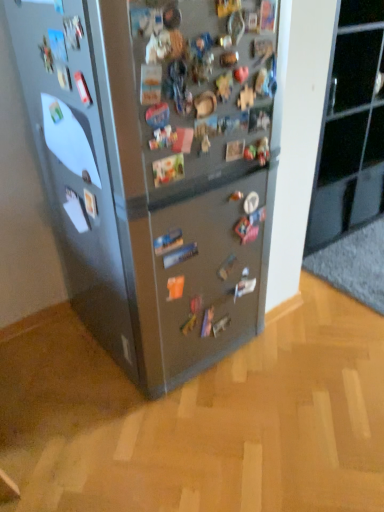
Question: From the image's perspective, would you say glossy black cabinet at upper right is shown under satin silver fridge at center?

Choices:
 (A) no
 (B) yes

Answer: (A)

Question: From the image's perspective, is glossy black cabinet at upper right above satin silver fridge at center?

Choices:
 (A) yes
 (B) no

Answer: (A)

Question: Would you say glossy black cabinet at upper right contains satin silver fridge at center?

Choices:
 (A) no
 (B) yes

Answer: (A)

Question: From a real-world perspective, is glossy black cabinet at upper right physically below satin silver fridge at center?

Choices:
 (A) no
 (B) yes

Answer: (B)

Question: Is glossy black cabinet at upper right far away from satin silver fridge at center?

Choices:
 (A) no
 (B) yes

Answer: (B)

Question: Is satin silver fridge at center at the back of glossy black cabinet at upper right?

Choices:
 (A) yes
 (B) no

Answer: (B)

Question: Considering the relative sizes of satin silver fridge at center and glossy black cabinet at upper right in the image provided, is satin silver fridge at center taller than glossy black cabinet at upper right?

Choices:
 (A) no
 (B) yes

Answer: (B)

Question: Considering the relative positions of satin silver fridge at center and glossy black cabinet at upper right in the image provided, is satin silver fridge at center to the right of glossy black cabinet at upper right from the viewer's perspective?

Choices:
 (A) no
 (B) yes

Answer: (A)

Question: Does satin silver fridge at center have a larger size compared to glossy black cabinet at upper right?

Choices:
 (A) no
 (B) yes

Answer: (B)

Question: Is satin silver fridge at center thinner than glossy black cabinet at upper right?

Choices:
 (A) yes
 (B) no

Answer: (B)

Question: Does satin silver fridge at center come behind glossy black cabinet at upper right?

Choices:
 (A) no
 (B) yes

Answer: (A)

Question: Can you confirm if satin silver fridge at center is positioned to the left of glossy black cabinet at upper right?

Choices:
 (A) no
 (B) yes

Answer: (B)

Question: Considering their positions, is glossy black cabinet at upper right located in front of or behind satin silver fridge at center?

Choices:
 (A) behind
 (B) front

Answer: (A)